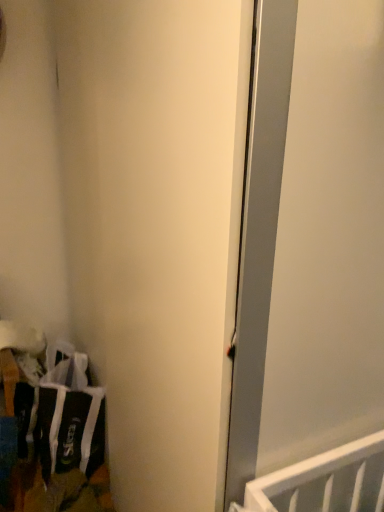
Question: Considering the positions of white matte door at center and black fabric laundry at lower left in the image, is white matte door at center bigger or smaller than black fabric laundry at lower left?

Choices:
 (A) big
 (B) small

Answer: (A)

Question: Looking at their shapes, would you say white matte door at center is wider or thinner than black fabric laundry at lower left?

Choices:
 (A) thin
 (B) wide

Answer: (B)

Question: Is white matte door at center situated inside black fabric laundry at lower left or outside?

Choices:
 (A) outside
 (B) inside

Answer: (A)

Question: From the image's perspective, is black fabric laundry at lower left located above or below white matte door at center?

Choices:
 (A) below
 (B) above

Answer: (A)

Question: In the image, is black fabric laundry at lower left positioned in front of or behind white matte door at center?

Choices:
 (A) front
 (B) behind

Answer: (B)

Question: Is point (61, 436) closer or farther from the camera than point (137, 328)?

Choices:
 (A) farther
 (B) closer

Answer: (A)

Question: Would you say black fabric laundry at lower left is inside or outside white matte door at center?

Choices:
 (A) outside
 (B) inside

Answer: (A)